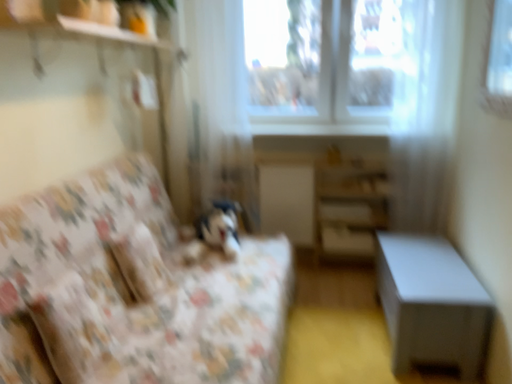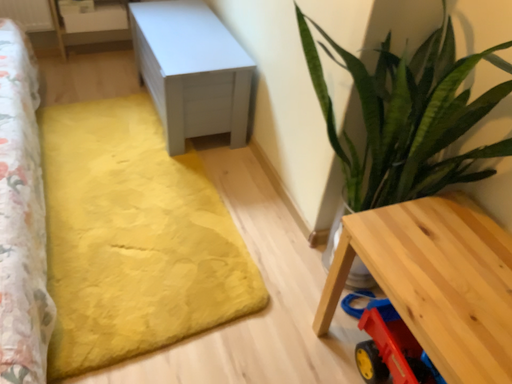
Question: How did the camera likely rotate when shooting the video?

Choices:
 (A) rotated right
 (B) rotated left

Answer: (A)